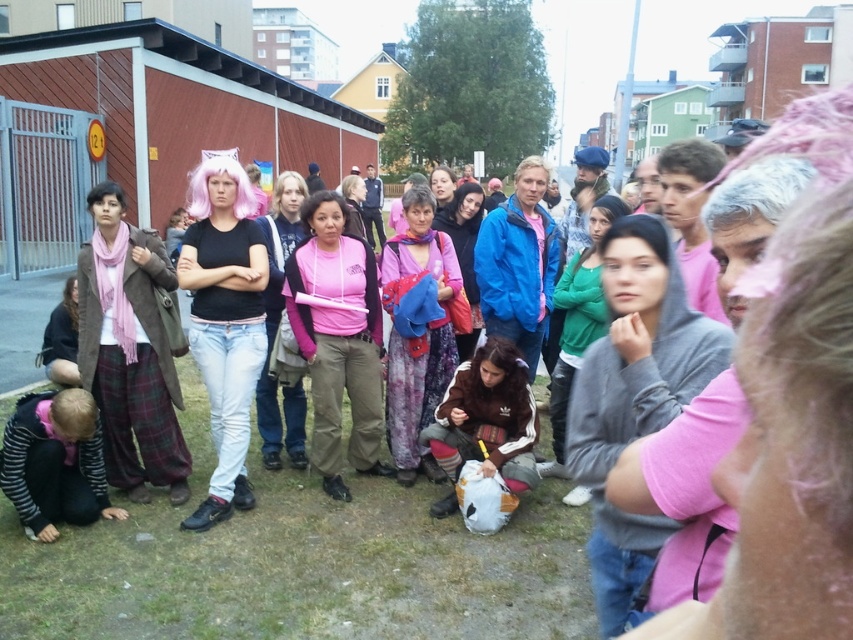
Question: In this image, where is pink scarf at center located relative to gray matte jacket at center?

Choices:
 (A) above
 (B) below

Answer: (B)

Question: Does gray fleece jacket at center have a lesser width compared to pink fabric jacket at center?

Choices:
 (A) no
 (B) yes

Answer: (A)

Question: Is pink fabric jacket at center positioned before pink fabric dress at center?

Choices:
 (A) no
 (B) yes

Answer: (B)

Question: Estimate the real-world distances between objects in this image. Which object is farther from the matte black shirt at center?

Choices:
 (A) brown fleece jacket at center
 (B) gray fleece jacket at center
 (C) pink fabric jacket at center
 (D) matte pink sweater at center

Answer: (B)

Question: Which of the following is the farthest from the observer?

Choices:
 (A) 135,353
 (B) 350,216

Answer: (B)

Question: Which object is positioned closest to the pink scarf at center?

Choices:
 (A) gray fleece jacket at center
 (B) matte black shirt at center
 (C) pink fabric dress at center
 (D) pink fabric jacket at center

Answer: (B)